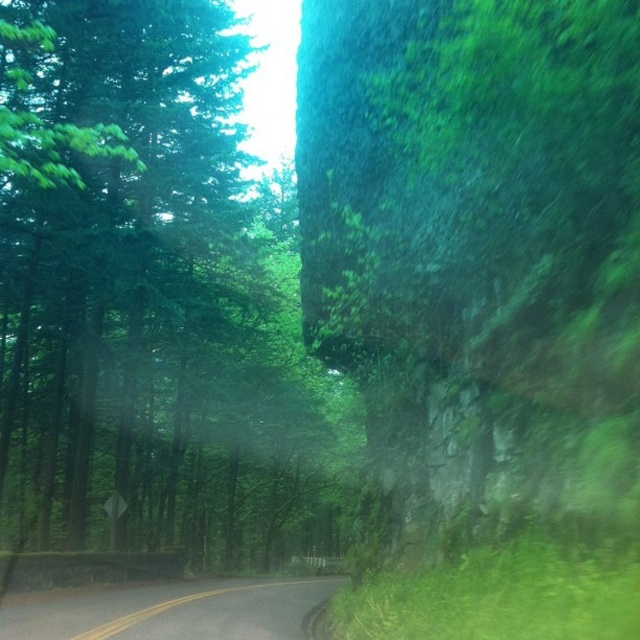
You are a driver approaching the green leafy tree at center and the black asphalt road at lower center. Which one appears wider from your perspective?

The green leafy tree at center appears wider than the black asphalt road at lower center because its width surpasses the road.

You are a driver approaching a curve in the road. You see a green leafy tree at center and a black asphalt road at lower center. Which object is larger in the image?

The green leafy tree at center is bigger than the black asphalt road at lower center according to the description.